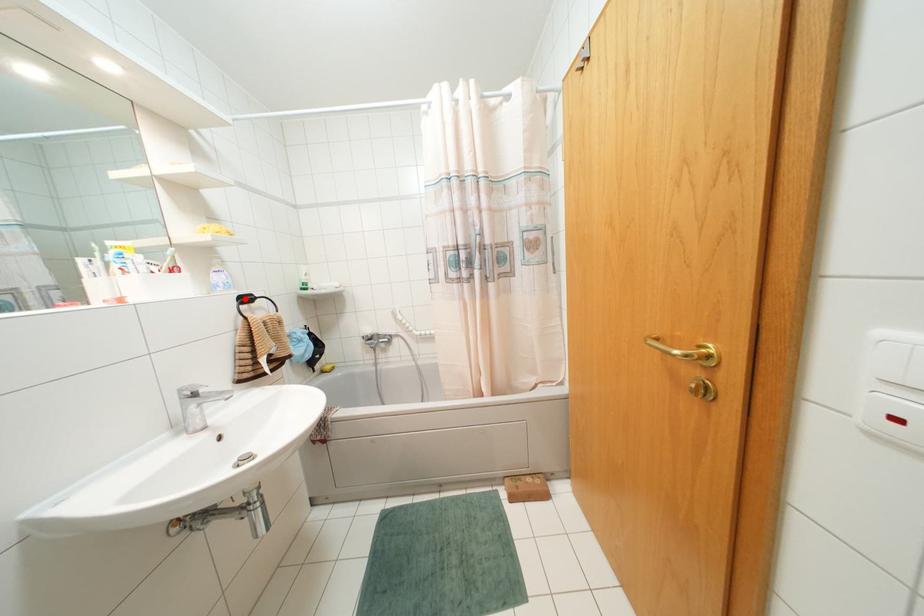
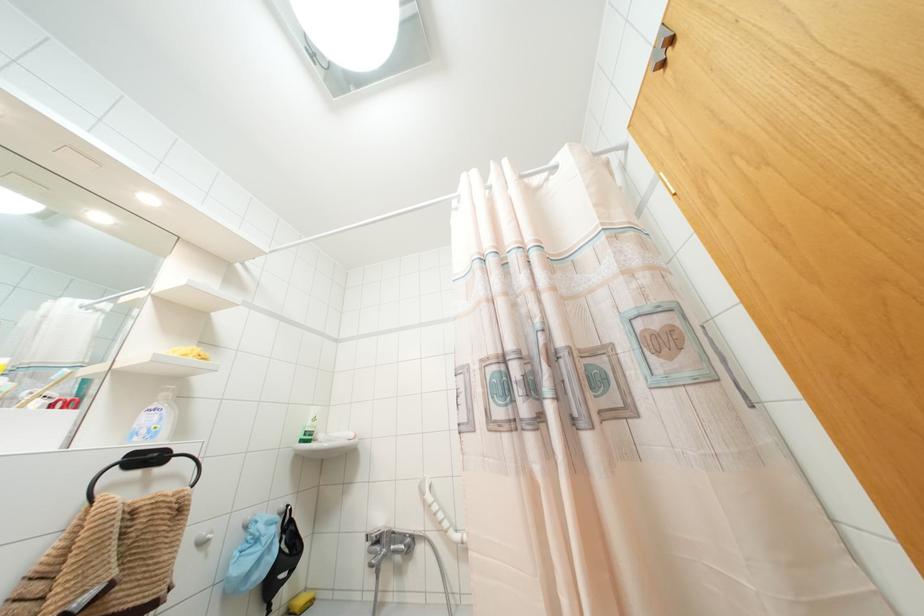
Where in the second image is the point corresponding to the highlighted location from the first image?

(147, 458)